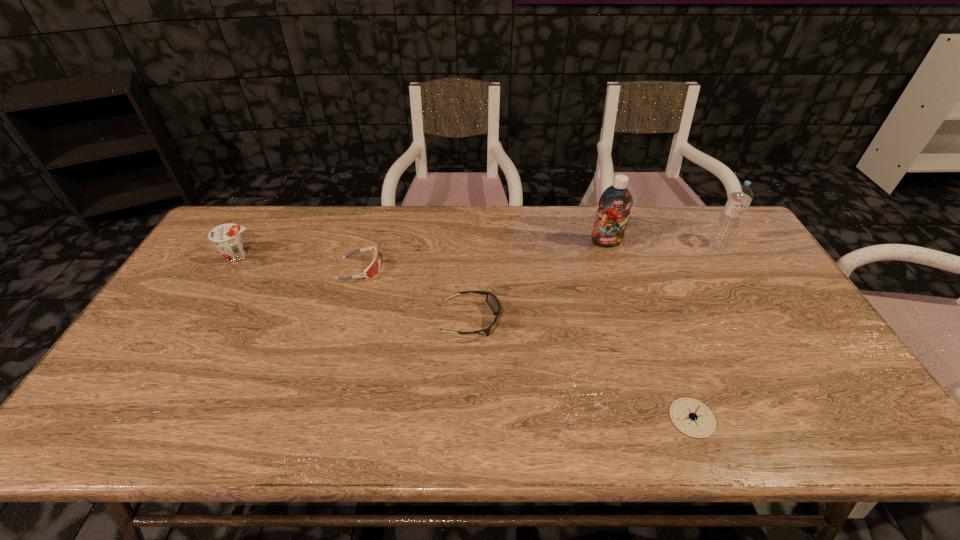
Find the location of a particular element. object present at the right edge is located at coordinates coord(741,196).

Image resolution: width=960 pixels, height=540 pixels. What are the coordinates of `object that is positioned at the far left corner` in the screenshot? It's located at (226, 237).

Locate an element on the screen. object that is at the far right corner is located at coordinates (741, 196).

You are a GUI agent. You are given a task and a screenshot of the screen. Output one action in this format:
    pyautogui.click(x=<x>, y=<y>)
    Task: Click on the vacant space at the far edge of the desktop
    This screenshot has width=960, height=540.
    Given the screenshot: What is the action you would take?
    pyautogui.click(x=328, y=214)

In the image, there is a desktop. Where is `vacant space at the right edge`? vacant space at the right edge is located at coordinates (779, 287).

Locate an element on the screen. This screenshot has width=960, height=540. vacant area at the near right corner is located at coordinates (829, 445).

At what (x,y) coordinates should I click in order to perform the action: click on free space between the water bottle and the yogurt. Please return your answer as a coordinate pair (x, y). Looking at the image, I should click on (479, 250).

You are a GUI agent. You are given a task and a screenshot of the screen. Output one action in this format:
    pyautogui.click(x=<x>, y=<y>)
    Task: Click on the unoccupied area between the shampoo and the right goggles
    
    Given the screenshot: What is the action you would take?
    pyautogui.click(x=539, y=281)

The height and width of the screenshot is (540, 960). Find the location of `unoccupied position between the shampoo and the third tallest object`. unoccupied position between the shampoo and the third tallest object is located at coordinates coord(422,249).

At what (x,y) coordinates should I click in order to perform the action: click on free space between the shampoo and the yogurt. Please return your answer as a coordinate pair (x, y). The width and height of the screenshot is (960, 540). Looking at the image, I should click on (422, 249).